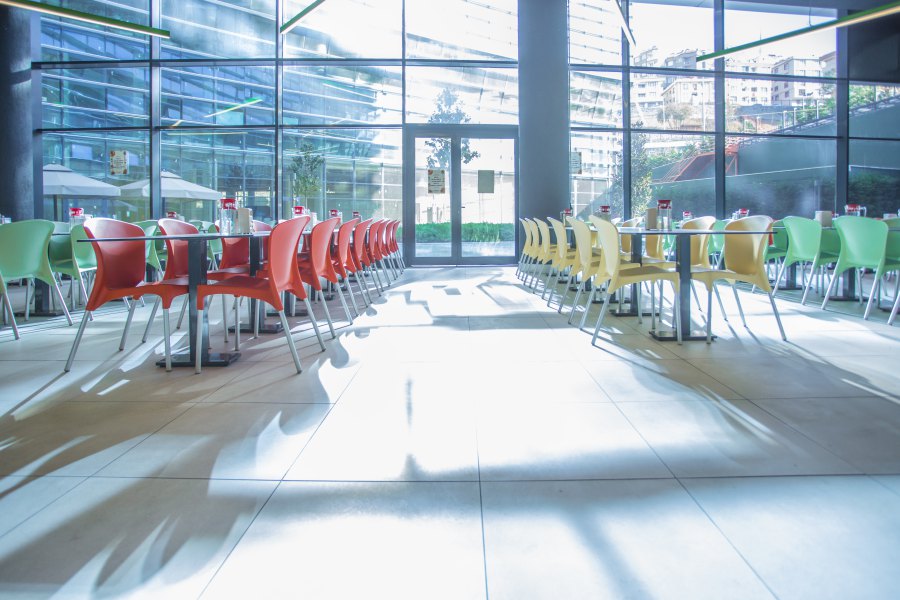
Find the location of a particular element. green chairs is located at coordinates (19, 263), (60, 248), (76, 253), (213, 247), (714, 245), (667, 245), (804, 240), (780, 241), (860, 248).